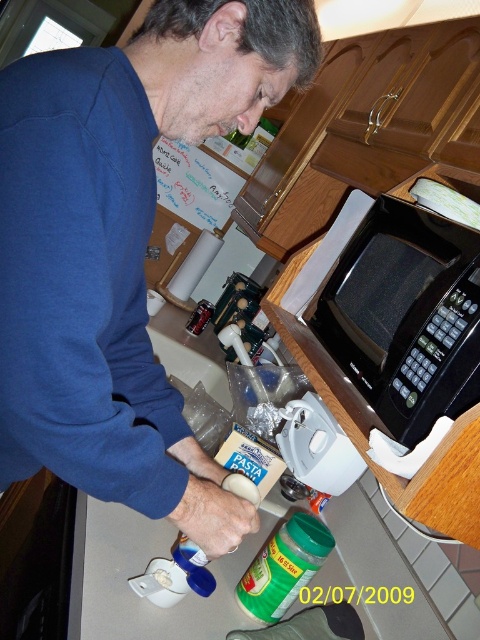
Question: Which of the following is the closest to the observer?

Choices:
 (A) (216, 611)
 (B) (119, 296)
 (C) (336, 304)

Answer: (B)

Question: Which point is closer to the camera?

Choices:
 (A) (226, 600)
 (B) (181, 433)

Answer: (B)

Question: Considering the relative positions of blue matte shirt at upper left and white glossy counter top at lower center in the image provided, where is blue matte shirt at upper left located with respect to white glossy counter top at lower center?

Choices:
 (A) below
 (B) above

Answer: (B)

Question: Does blue matte shirt at upper left appear over white glossy counter top at lower center?

Choices:
 (A) no
 (B) yes

Answer: (B)

Question: Among these objects, which one is nearest to the camera?

Choices:
 (A) white glossy counter top at lower center
 (B) white matte pasta at center
 (C) black plastic microwave at upper right

Answer: (C)

Question: Is blue matte shirt at upper left positioned in front of white glossy counter top at lower center?

Choices:
 (A) yes
 (B) no

Answer: (A)